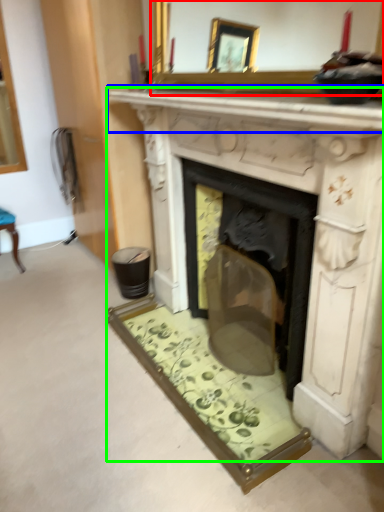
Question: Which object is the closest to the mirror (highlighted by a red box)? Choose among these: mantle (highlighted by a blue box) or fireplace (highlighted by a green box).

Choices:
 (A) mantle
 (B) fireplace

Answer: (A)